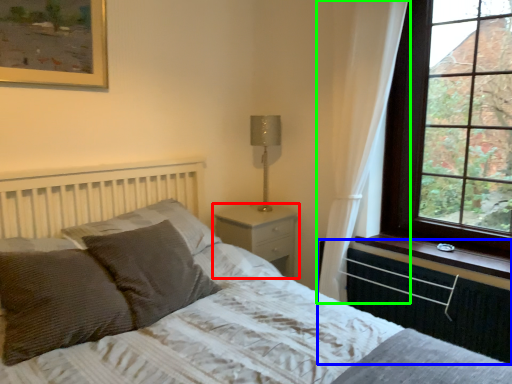
Question: Which object is the farthest from nightstand (highlighted by a red box)? Choose among these: radiator (highlighted by a blue box) or curtain (highlighted by a green box).

Choices:
 (A) radiator
 (B) curtain

Answer: (A)